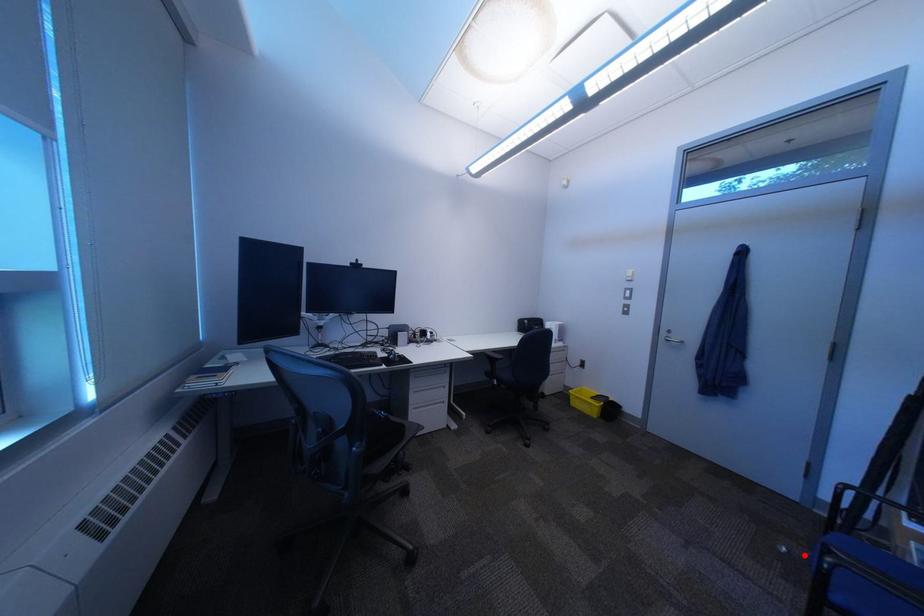
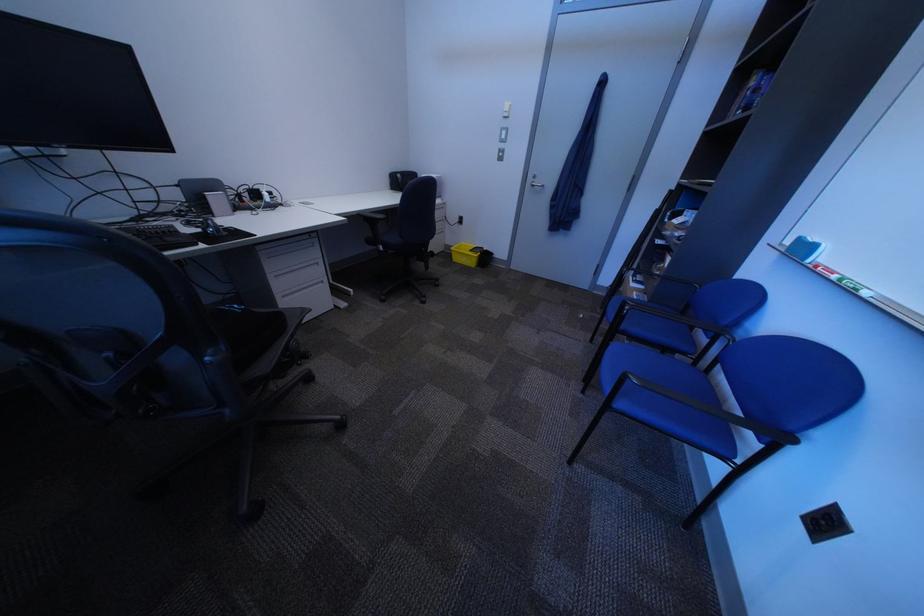
Question: I am providing you with two images of the same scene from different viewpoints. A red point is shown in image1. For the corresponding object point in image2, is it positioned nearer or farther from the camera?

Choices:
 (A) Nearer
 (B) Farther

Answer: (A)